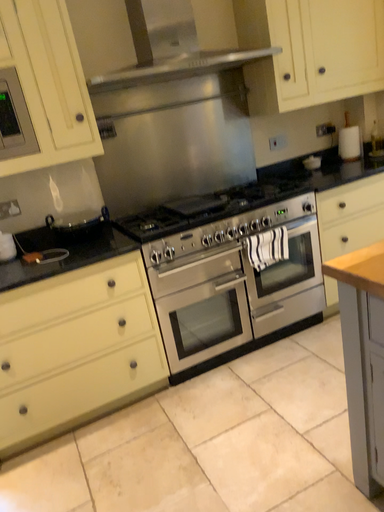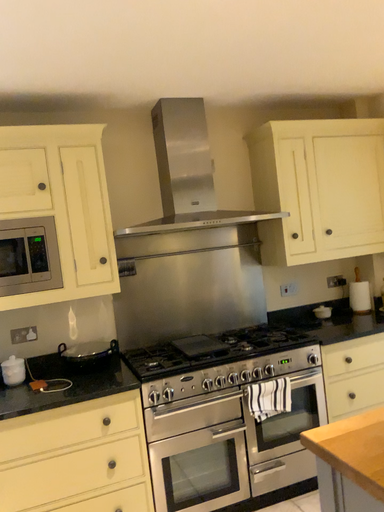
Question: Which way did the camera rotate in the video?

Choices:
 (A) rotated downward
 (B) rotated upward

Answer: (B)